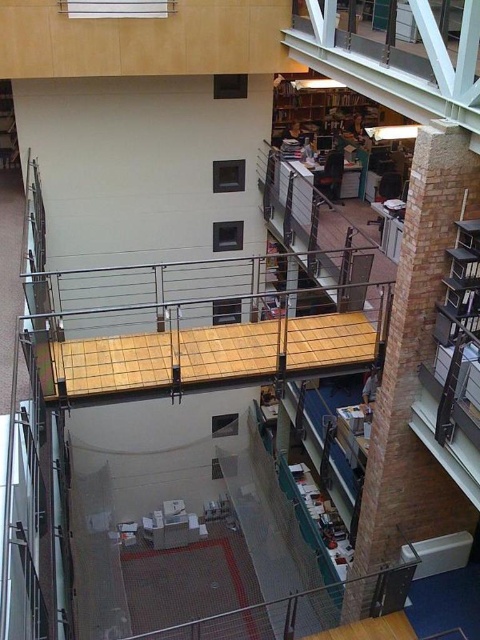
You are standing at the base of the staircase in the modern multi level building. You need to move a 10 foot long ladder from the lower level to the upper balcony. The ladder is too long to carry vertically. Is there enough space horizontally between the brick wall at right and the wooden floor of the upper balcony to fit the ladder horizontally?

The distance between the brick wall at right and the wooden floor of the upper balcony is 21.42 feet. Since the ladder is 10 feet long, there is sufficient horizontal space to fit it between them.

You are standing in the modern multi level building and want to take a photo of both the point at (395,436) and the point at (0,148). Will both points be in focus if you focus on the closer one?

Yes, both points will be in focus because the point at (395,436) is closer to the camera than the point at (0,148). When focusing on the closer point, the depth of field may still include the farther point depending on the aperture setting, but since the distance between them isn